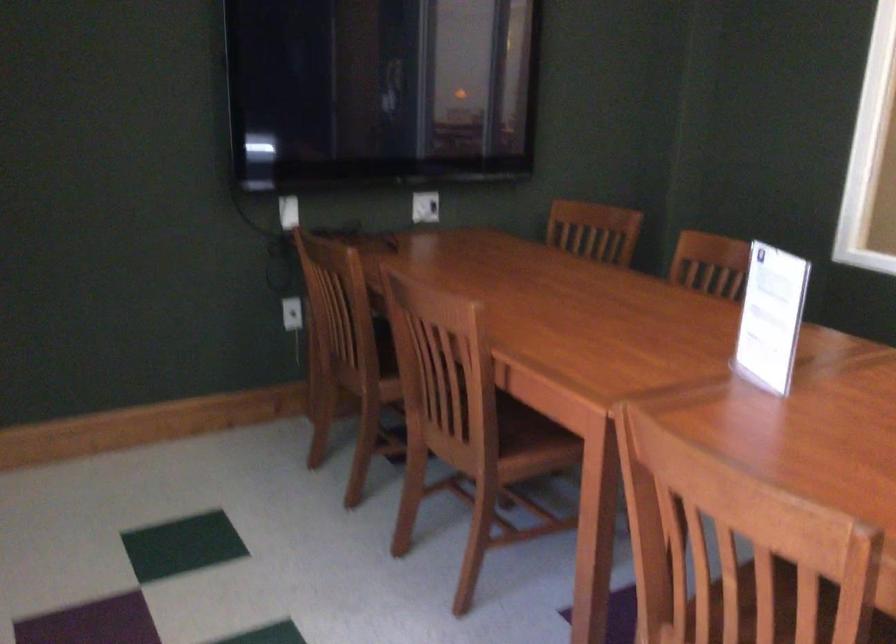
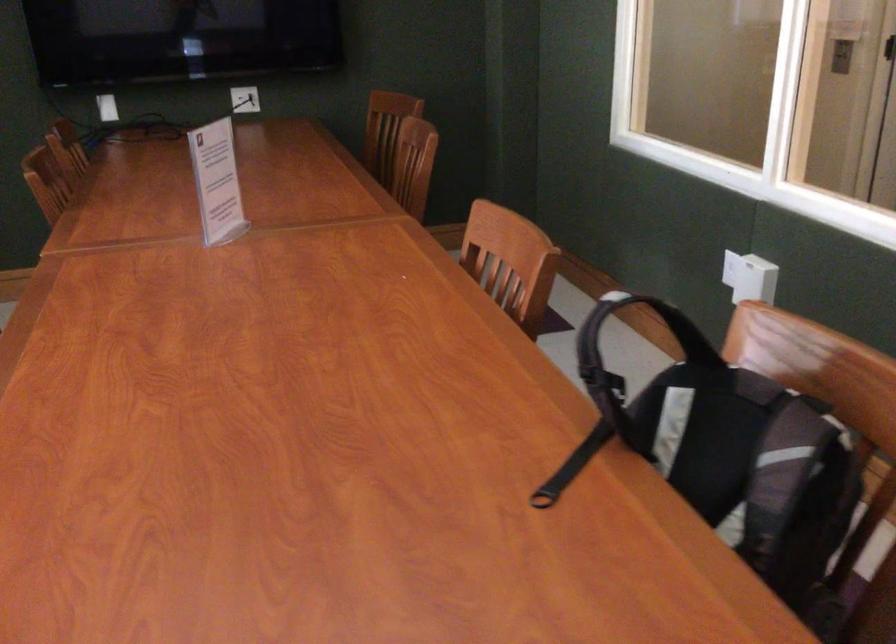
Locate, in the second image, the point that corresponds to (429,210) in the first image.

(245, 99)